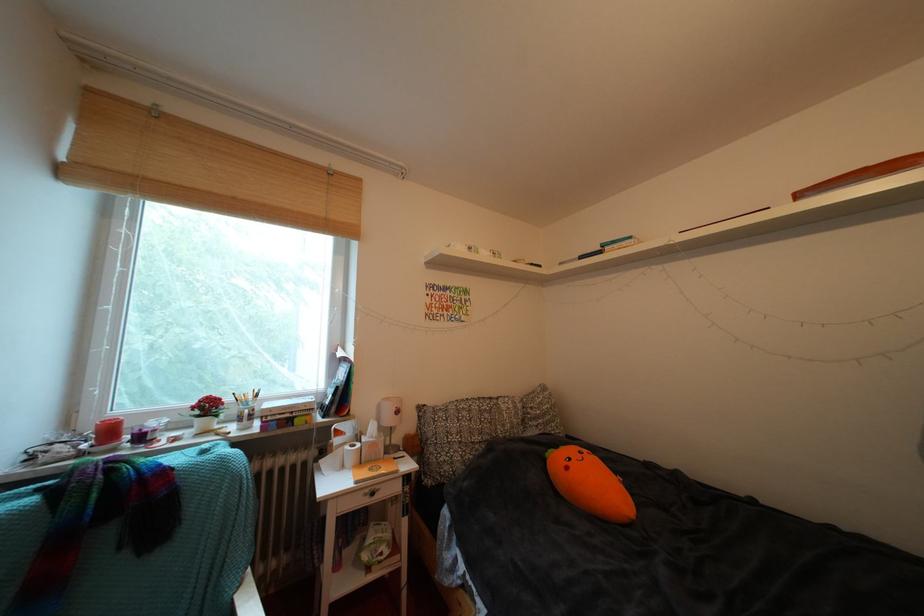
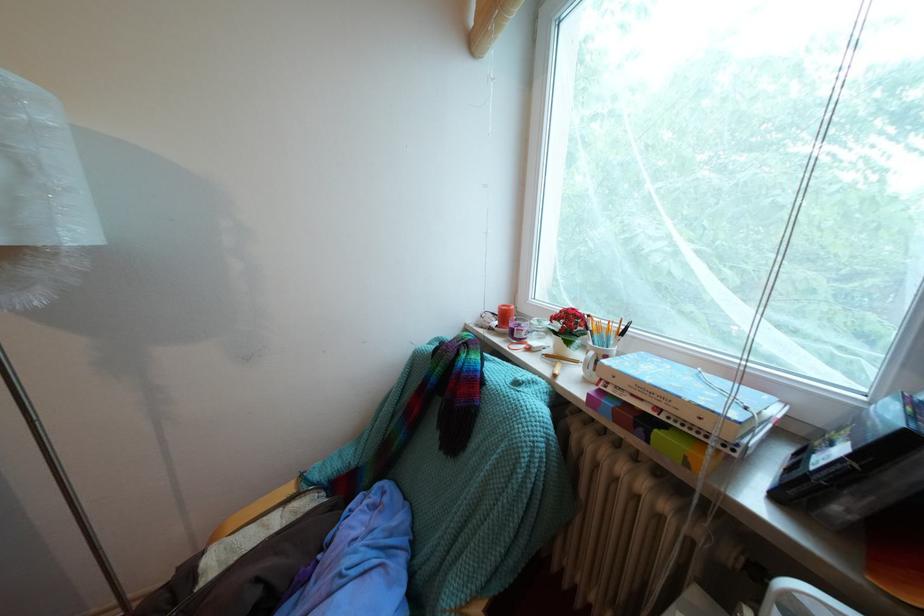
The point at (257, 416) is marked in the first image. Where is the corresponding point in the second image?

(602, 359)